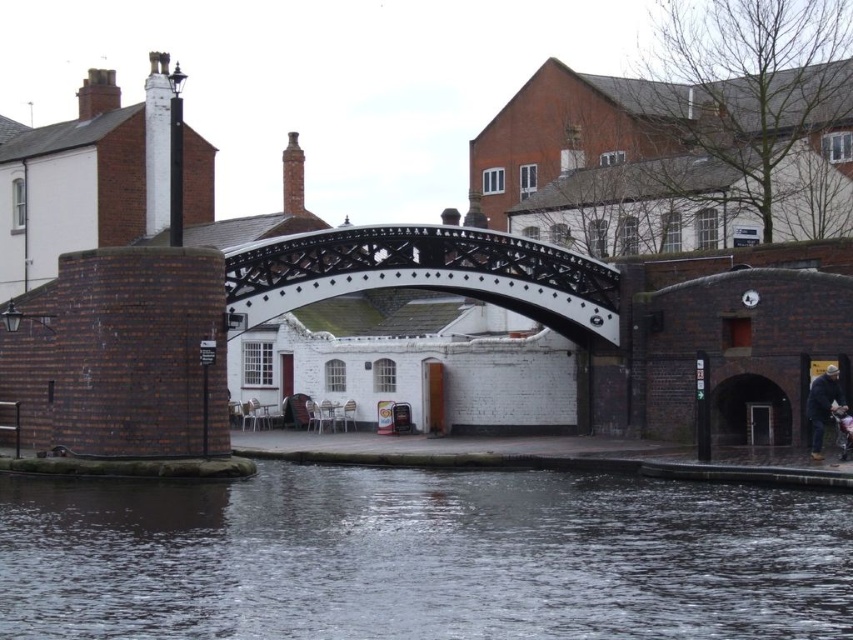
Does brown water at lower center have a greater width compared to dark blue jacket at lower right?

Yes.

Is brown water at lower center smaller than dark blue jacket at lower right?

Actually, brown water at lower center might be larger than dark blue jacket at lower right.

Identify the location of brown water at lower center. (421, 557).

Can you confirm if brown water at lower center is thinner than black polished wood bridge at center?

Incorrect, brown water at lower center's width is not less than black polished wood bridge at center's.

Does brown water at lower center have a greater width compared to black polished wood bridge at center?

Correct, the width of brown water at lower center exceeds that of black polished wood bridge at center.

Where is `brown water at lower center`? The image size is (853, 640). brown water at lower center is located at coordinates click(x=421, y=557).

Is black polished wood bridge at center above dark blue jacket at lower right?

Yes.

Is black polished wood bridge at center smaller than dark blue jacket at lower right?

No, black polished wood bridge at center is not smaller than dark blue jacket at lower right.

Identify the location of black polished wood bridge at center. (422, 275).

Find the location of a particular element. The height and width of the screenshot is (640, 853). black polished wood bridge at center is located at coordinates [x=422, y=275].